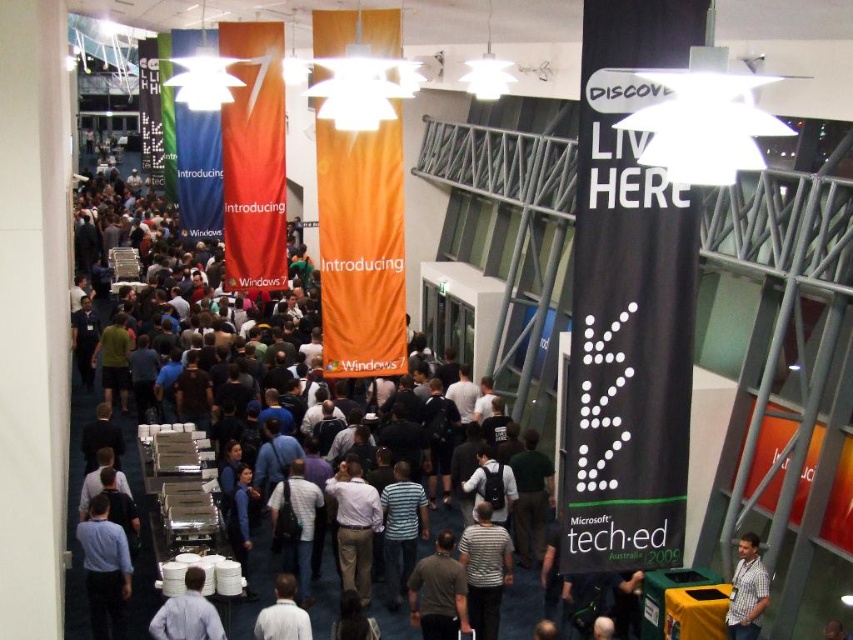
Question: Does dark gray shirt at center come behind light blue shirt at center?

Choices:
 (A) no
 (B) yes

Answer: (B)

Question: Is checkered shirt at center positioned at the back of light blue shirt at center?

Choices:
 (A) yes
 (B) no

Answer: (A)

Question: Does checkered shirt at center have a smaller size compared to light blue shirt at center?

Choices:
 (A) no
 (B) yes

Answer: (B)

Question: Which point is closer to the camera?

Choices:
 (A) light blue shirt at center
 (B) light blue shirt at lower left
 (C) white shirt at center

Answer: (A)

Question: Which point is farther from the camera taking this photo?

Choices:
 (A) click(260, 637)
 (B) click(160, 621)
 (C) click(730, 634)

Answer: (C)

Question: Which object appears farthest from the camera in this image?

Choices:
 (A) checkered shirt at center
 (B) white shirt at center
 (C) striped cotton shirt at center
 (D) light blue shirt at center

Answer: (C)